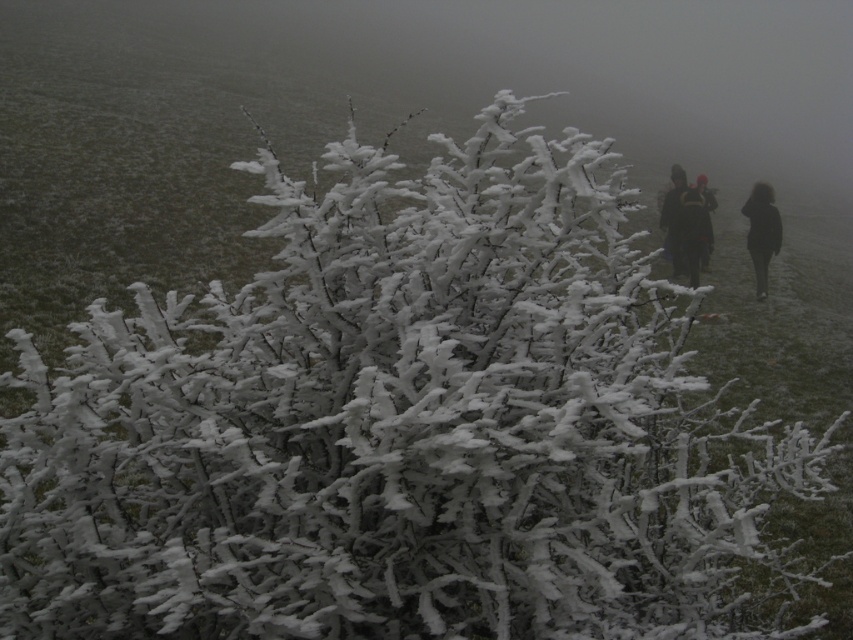
Describe the element at coordinates (761, 232) in the screenshot. I see `black matte coat at right` at that location.

Which is in front, point (764, 298) or point (677, 269)?

Point (677, 269) is in front.

Where is `black matte coat at right`? The height and width of the screenshot is (640, 853). black matte coat at right is located at coordinates (761, 232).

Is black matte coat at right below dark blue jacket at right?

Yes, black matte coat at right is below dark blue jacket at right.

Identify the location of black matte coat at right. (761, 232).

Does dark fabric jacket at right have a lesser width compared to dark blue jacket at right?

Yes, dark fabric jacket at right is thinner than dark blue jacket at right.

Can you confirm if dark fabric jacket at right is positioned to the left of dark blue jacket at right?

Indeed, dark fabric jacket at right is positioned on the left side of dark blue jacket at right.

What are the coordinates of `dark fabric jacket at right` in the screenshot? It's located at (672, 220).

This screenshot has height=640, width=853. Find the location of `dark fabric jacket at right`. dark fabric jacket at right is located at coordinates (672, 220).